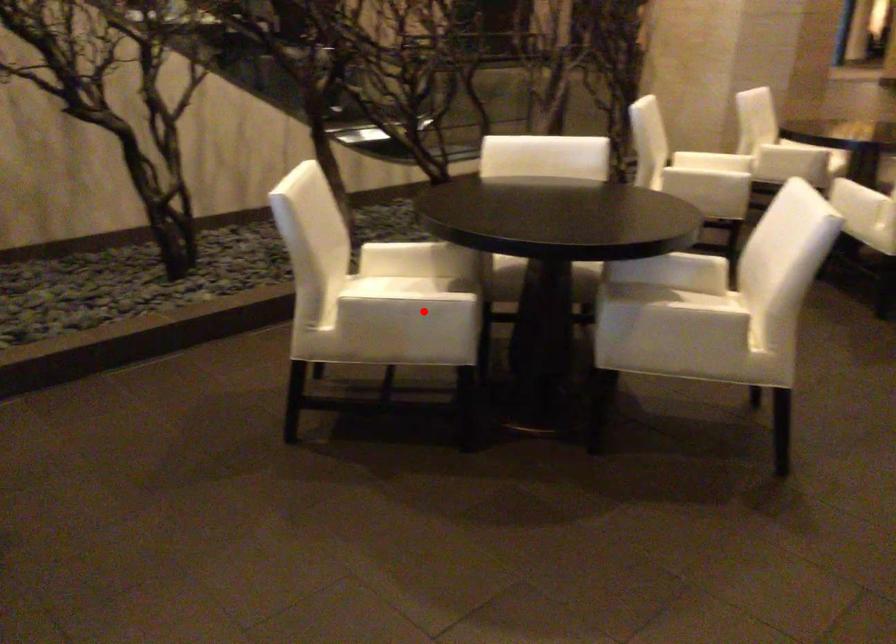
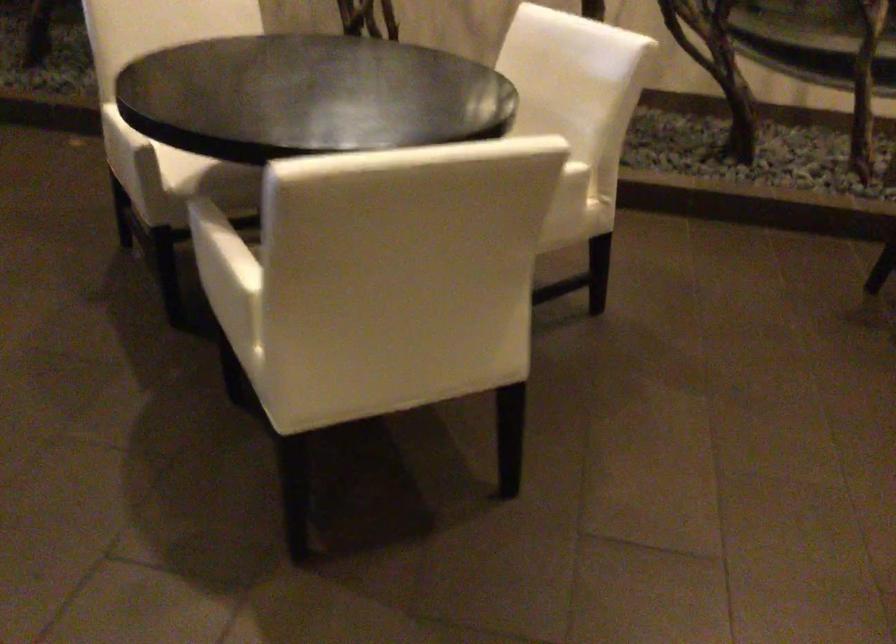
Question: A red point is marked in image1. In image2, is the corresponding 3D point closer to the camera or farther? Reply with the corresponding letter.

Choices:
 (A) The corresponding 3D point is closer.
 (B) The corresponding 3D point is farther.

Answer: (A)